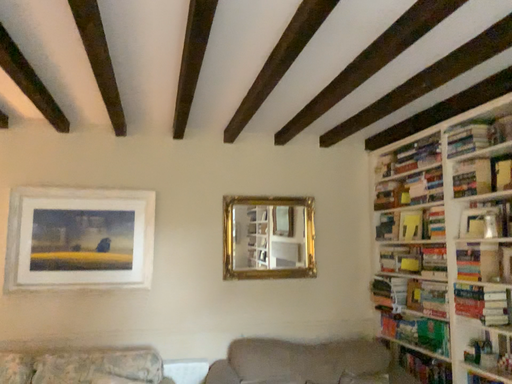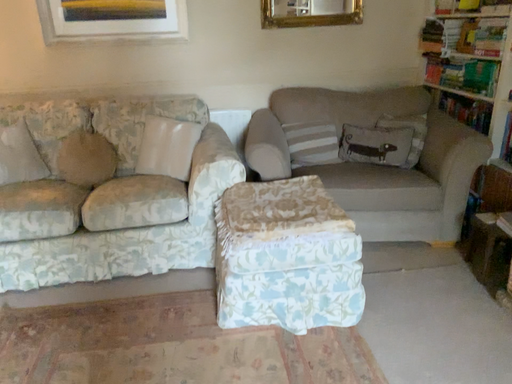
Question: How did the camera likely rotate when shooting the video?

Choices:
 (A) rotated downward
 (B) rotated upward

Answer: (A)